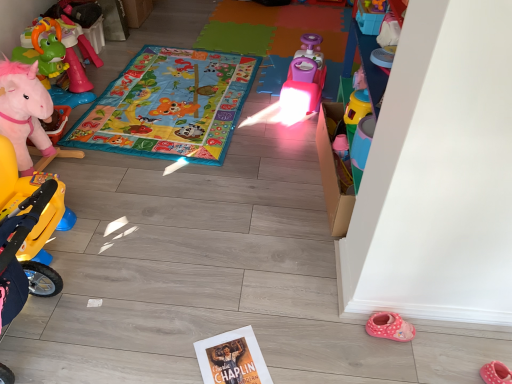
Question: Does pink plush unicorn at left, the third toy when ordered from front to back, appear on the right side of translucent plastic cup at center-right, which is the 1th toy in front-to-back order?

Choices:
 (A) yes
 (B) no

Answer: (B)

Question: Is pink plush unicorn at left, the third toy when ordered from front to back, next to translucent plastic cup at center-right, marked as the third toy in a left-to-right arrangement?

Choices:
 (A) yes
 (B) no

Answer: (B)

Question: From the image's perspective, does pink plush unicorn at left, placed as the third toy when sorted from right to left, appear higher than translucent plastic cup at center-right, marked as the third toy in a back-to-front arrangement?

Choices:
 (A) yes
 (B) no

Answer: (A)

Question: Considering the relative sizes of pink plush unicorn at left, placed as the third toy when sorted from right to left, and translucent plastic cup at center-right, which is the 1th toy in front-to-back order, in the image provided, is pink plush unicorn at left, placed as the third toy when sorted from right to left, thinner than translucent plastic cup at center-right, which is the 1th toy in front-to-back order,?

Choices:
 (A) no
 (B) yes

Answer: (A)

Question: Is pink plush unicorn at left, the 1th toy viewed from the back, taller than translucent plastic cup at center-right, which appears as the first toy when viewed from the right?

Choices:
 (A) no
 (B) yes

Answer: (B)

Question: From the image's perspective, relative to pink fabric slipper at lower right, is pink plastic toy car at center, which is the second toy from front to back, above or below?

Choices:
 (A) below
 (B) above

Answer: (B)

Question: Is point (300, 61) closer or farther from the camera than point (504, 372)?

Choices:
 (A) farther
 (B) closer

Answer: (A)

Question: From a real-world perspective, relative to pink fabric slipper at lower right, is pink plastic toy car at center, which is the 2th toy from right to left, vertically above or below?

Choices:
 (A) above
 (B) below

Answer: (A)

Question: Considering the positions of pink plastic toy car at center, the 2th toy in the back-to-front sequence, and pink fabric slipper at lower right in the image, is pink plastic toy car at center, the 2th toy in the back-to-front sequence, taller or shorter than pink fabric slipper at lower right?

Choices:
 (A) tall
 (B) short

Answer: (A)

Question: From the image's perspective, is translucent plastic cup at center-right, marked as the third toy in a left-to-right arrangement, located above or below pink fabric slipper at lower right?

Choices:
 (A) above
 (B) below

Answer: (A)

Question: Would you say translucent plastic cup at center-right, which is the 1th toy in front-to-back order, is to the left or to the right of pink fabric slipper at lower right in the picture?

Choices:
 (A) left
 (B) right

Answer: (A)

Question: Is translucent plastic cup at center-right, marked as the third toy in a left-to-right arrangement, taller or shorter than pink fabric slipper at lower right?

Choices:
 (A) short
 (B) tall

Answer: (B)

Question: Considering their positions, is translucent plastic cup at center-right, which is the 1th toy in front-to-back order, located in front of or behind pink fabric slipper at lower right?

Choices:
 (A) front
 (B) behind

Answer: (B)

Question: Does point (349, 124) appear closer or farther from the camera than point (143, 71)?

Choices:
 (A) closer
 (B) farther

Answer: (A)

Question: Do you think translucent plastic cup at center-right, which appears as the first toy when viewed from the right, is within multicolored fabric play mat at center, or outside of it?

Choices:
 (A) inside
 (B) outside

Answer: (B)